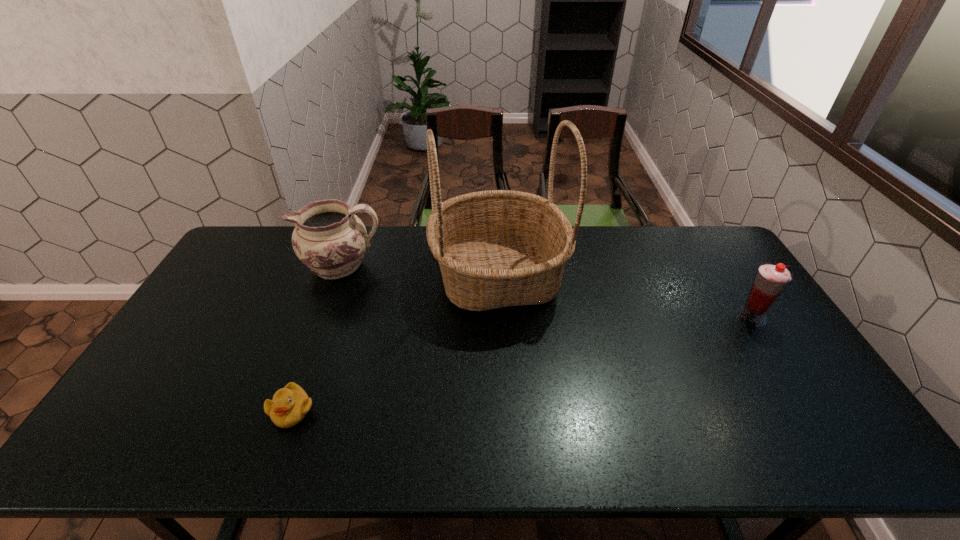
At what (x,y) coordinates should I click in order to perform the action: click on vacant point at the far right corner. Please return your answer as a coordinate pair (x, y). This screenshot has height=540, width=960. Looking at the image, I should click on (718, 259).

What are the coordinates of `free spot between the basket and the shortest object` in the screenshot? It's located at (395, 343).

I want to click on unoccupied position between the pitcher and the tallest object, so click(x=420, y=271).

In order to click on vacant space that's between the pitcher and the basket in this screenshot , I will do `click(420, 271)`.

Locate an element on the screen. This screenshot has height=540, width=960. free space between the basket and the duckling is located at coordinates (395, 343).

Identify the location of vacant space that's between the nearest object and the pitcher. (317, 338).

I want to click on free spot between the third object from left to right and the rightmost object, so click(x=625, y=296).

Identify the location of vacant area that lies between the pitcher and the nearest object. The width and height of the screenshot is (960, 540). (317, 338).

This screenshot has height=540, width=960. Identify the location of vacant space in between the shortest object and the basket. (395, 343).

Where is `object that is the third closest to the rightmost object`? This screenshot has height=540, width=960. object that is the third closest to the rightmost object is located at coordinates (289, 406).